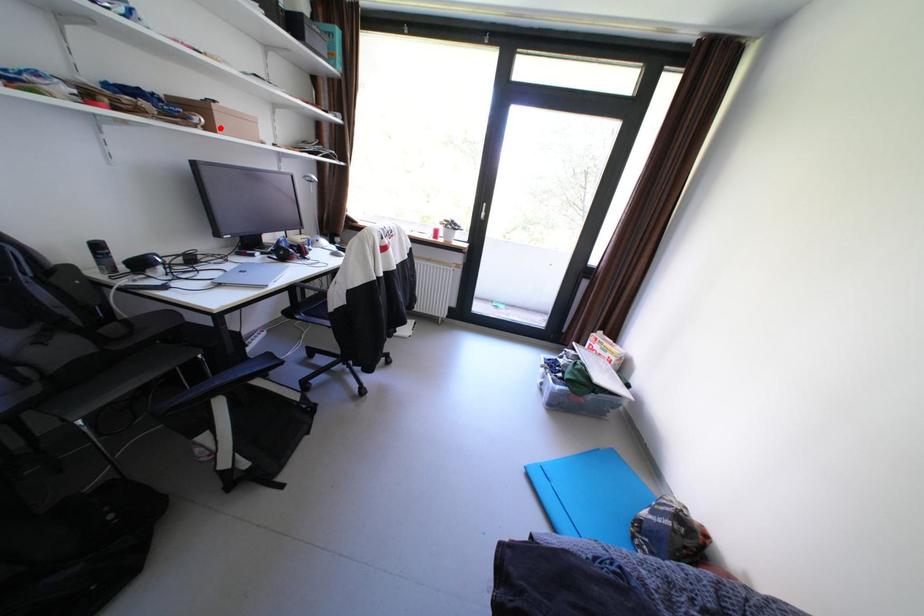
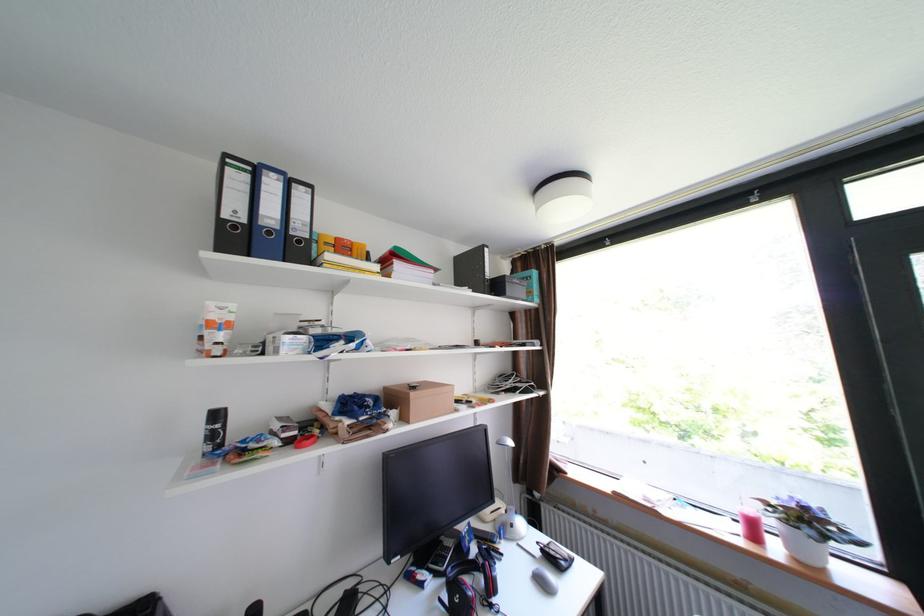
In the second image, find the point that corresponds to the highlighted location in the first image.

(415, 419)